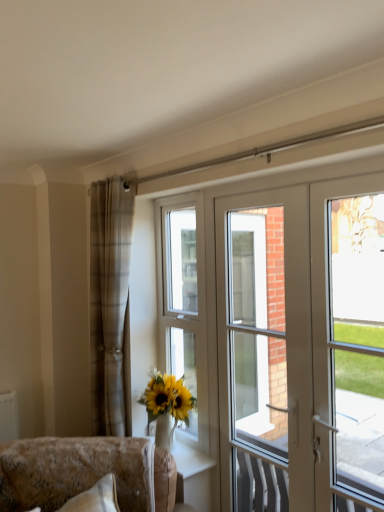
This screenshot has width=384, height=512. What do you see at coordinates (183, 303) in the screenshot?
I see `white plastic window at center` at bounding box center [183, 303].

This screenshot has width=384, height=512. Describe the element at coordinates (190, 460) in the screenshot. I see `white glossy vase at lower center` at that location.

What is the approximate width of white glossy door at center?

It is 7.63 inches.

At what (x,y) coordinates should I click in order to perform the action: click on white glossy door at right. Please return your answer as a coordinate pair (x, y). Looking at the image, I should click on (302, 345).

Looking at this image, is white glossy door at center far from white glossy vase at lower center?

Yes.

Is point (231, 381) positioned in front of point (196, 454)?

Yes, point (231, 381) is closer to viewer.

Is white glossy door at center thinner than white glossy vase at lower center?

Yes, white glossy door at center is thinner than white glossy vase at lower center.

Is white glossy door at center positioned with its back to white glossy vase at lower center?

white glossy door at center is not turned away from white glossy vase at lower center.

From the image's perspective, is plaid fabric curtain at left below velvet beige sofa at lower left?

Incorrect, from the image's perspective, plaid fabric curtain at left is higher than velvet beige sofa at lower left.

Is plaid fabric curtain at left placed right next to velvet beige sofa at lower left?

No, plaid fabric curtain at left is not next to velvet beige sofa at lower left.

From their relative heights in the image, would you say plaid fabric curtain at left is taller or shorter than velvet beige sofa at lower left?

Clearly, plaid fabric curtain at left is taller compared to velvet beige sofa at lower left.

Is velvet beige sofa at lower left located within plaid fabric curtain at left?

No, velvet beige sofa at lower left is not inside plaid fabric curtain at left.

Is white glossy door at right smaller than white plastic window at center?

Actually, white glossy door at right might be larger than white plastic window at center.

From a real-world perspective, which is physically above, white glossy door at right or white plastic window at center?

white plastic window at center, from a real-world perspective.

Is the depth of white glossy door at right less than that of white plastic window at center?

Yes, it is.

Looking at this image, is white plastic window at center surrounded by white glossy door at right?

No, white plastic window at center is not surrounded by white glossy door at right.

Is white plastic window at center further to the viewer compared to white glossy vase at lower center?

Yes, it is.

From a real-world perspective, who is located higher, white plastic window at center or white glossy vase at lower center?

From a 3D spatial view, white plastic window at center is above.

Is white plastic window at center smaller than white glossy vase at lower center?

No, white plastic window at center is not smaller than white glossy vase at lower center.

How much distance is there between white plastic window at center and white glossy vase at lower center?

white plastic window at center is 22.85 inches away from white glossy vase at lower center.

Does white glossy vase at lower center have a larger size compared to white glossy door at right?

No, white glossy vase at lower center is not bigger than white glossy door at right.

Considering the relative positions of white glossy vase at lower center and white glossy door at right in the image provided, is white glossy vase at lower center to the left of white glossy door at right from the viewer's perspective?

Yes, white glossy vase at lower center is to the left of white glossy door at right.

From the image's perspective, relative to white glossy door at right, is white glossy vase at lower center above or below?

white glossy vase at lower center is situated lower than white glossy door at right in the image.

Is the position of white glossy vase at lower center less distant than that of white glossy door at right?

No, it is behind white glossy door at right.

Which of these two, white glossy door at center or plaid fabric curtain at left, is wider?

Wider between the two is white glossy door at center.

Is white glossy door at center beside plaid fabric curtain at left?

No, white glossy door at center is not beside plaid fabric curtain at left.

Where is `screen door below the plaid fabric curtain at left (from a real-world perspective)`? The image size is (384, 512). screen door below the plaid fabric curtain at left (from a real-world perspective) is located at coordinates (254, 345).

How far apart are white glossy door at center and plaid fabric curtain at left?

white glossy door at center and plaid fabric curtain at left are 1.46 meters apart from each other.

In the scene shown: Is white glossy door at center positioned with its back to white glossy door at right?

Yes, white glossy door at center's orientation is away from white glossy door at right.

Considering the relative sizes of white glossy door at center and white glossy door at right in the image provided, is white glossy door at center taller than white glossy door at right?

No.

Is white glossy door at center inside the boundaries of white glossy door at right, or outside?

white glossy door at center fits inside white glossy door at right.

Can you confirm if white glossy door at center is positioned to the right of white glossy door at right?

No, white glossy door at center is not to the right of white glossy door at right.

The image size is (384, 512). I want to click on screen door above the white glossy vase at lower center (from a real-world perspective), so click(254, 345).

Where is `curtain that is above the velvet beige sofa at lower left (from the image's perspective)`? This screenshot has width=384, height=512. curtain that is above the velvet beige sofa at lower left (from the image's perspective) is located at coordinates (110, 306).

Looking at the image, which one is located closer to clear glass door at right, white plastic window at center or velvet beige sofa at lower left?

white plastic window at center is closer to clear glass door at right.

Considering their positions, is white glossy vase at lower center positioned further to velvet beige sofa at lower left than white glossy door at center?

Based on the image, white glossy door at center appears to be further to velvet beige sofa at lower left.

Based on their spatial positions, is clear glass door at right or white glossy door at right further from plaid fabric curtain at left?

clear glass door at right is further to plaid fabric curtain at left.

When comparing their distances from white glossy door at right, does velvet beige sofa at lower left or plaid fabric curtain at left seem further?

Based on the image, plaid fabric curtain at left appears to be further to white glossy door at right.

Based on their spatial positions, is velvet beige sofa at lower left or white glossy door at right further from clear glass door at right?

velvet beige sofa at lower left lies further to clear glass door at right than the other object.

Estimate the real-world distances between objects in this image. Which object is further from white glossy vase at lower center, white glossy door at center or clear glass door at right?

Based on the image, white glossy door at center appears to be further to white glossy vase at lower center.

Looking at the image, which one is located further to velvet beige sofa at lower left, white glossy door at right or white glossy door at center?

white glossy door at center is positioned further to the anchor velvet beige sofa at lower left.

Considering their positions, is white plastic window at center positioned further to clear glass door at right than plaid fabric curtain at left?

Among the two, plaid fabric curtain at left is located further to clear glass door at right.

What are the coordinates of `screen door located between plaid fabric curtain at left and white glossy door at right in the left-right direction` in the screenshot? It's located at (254, 345).

Identify the location of window sill located between plaid fabric curtain at left and white glossy door at right in the left-right direction. (190, 460).

Where is `curtain between velvet beige sofa at lower left and white glossy door at right in the horizontal direction`? This screenshot has width=384, height=512. curtain between velvet beige sofa at lower left and white glossy door at right in the horizontal direction is located at coordinates (110, 306).

Locate an element on the screen. The height and width of the screenshot is (512, 384). door positioned between clear glass door at right and white glossy door at center from near to far is located at coordinates (302, 345).